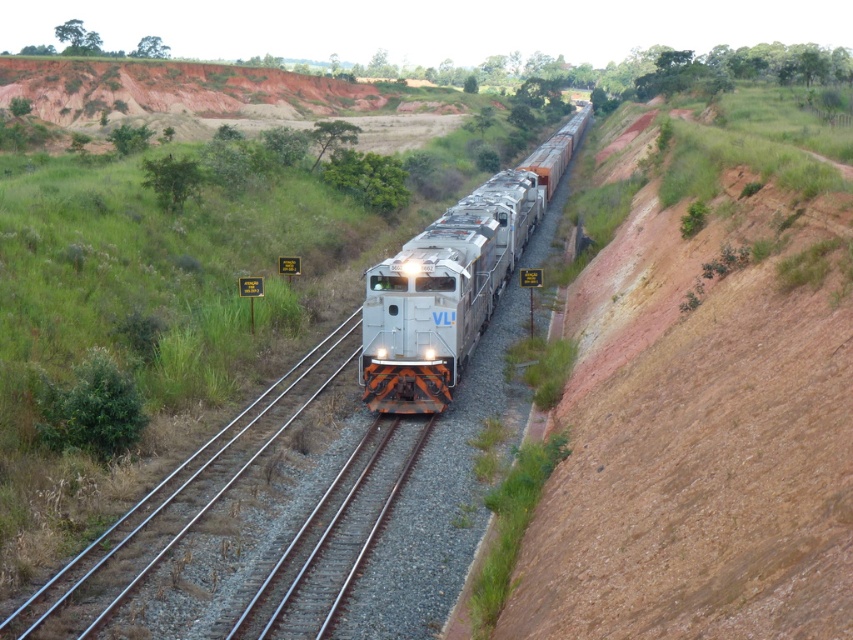
Question: Does silver metallic train at center appear on the left side of metal/smooth train track at center?

Choices:
 (A) yes
 (B) no

Answer: (B)

Question: Can you confirm if silver metallic train at center is smaller than metal/smooth train track at center?

Choices:
 (A) no
 (B) yes

Answer: (A)

Question: Can you confirm if silver metallic train at center is positioned above metal/smooth train track at center?

Choices:
 (A) yes
 (B) no

Answer: (A)

Question: Which object appears closest to the camera in this image?

Choices:
 (A) metal/smooth train track at center
 (B) silver metallic train at center

Answer: (A)

Question: Among these objects, which one is farthest from the camera?

Choices:
 (A) metal/smooth train track at center
 (B) silver metallic train at center

Answer: (B)

Question: Which object appears farthest from the camera in this image?

Choices:
 (A) silver metallic train at center
 (B) metal/smooth train track at center

Answer: (A)